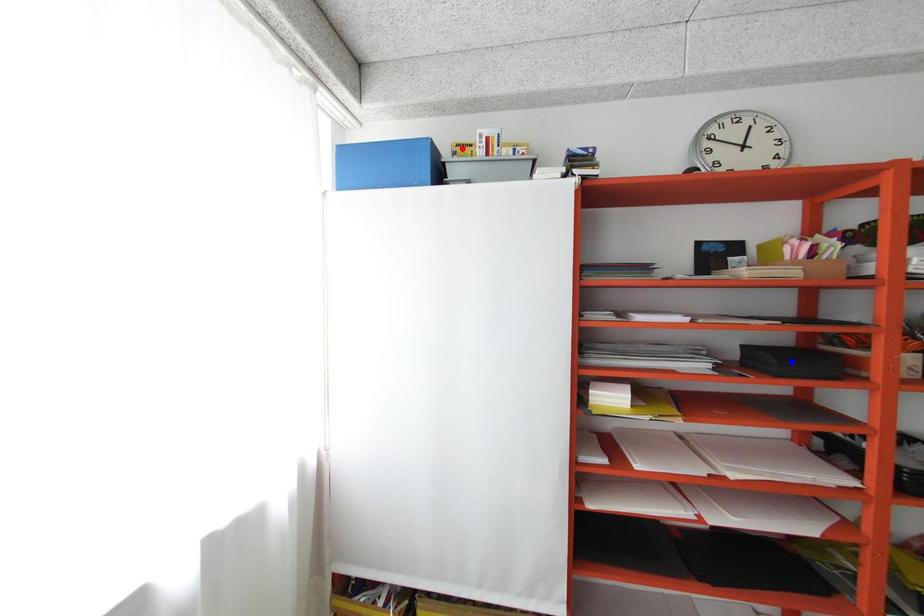
Question: Which of the two points in the image is closer to the camera?

Choices:
 (A) Blue point is closer.
 (B) Red point is closer.

Answer: (A)